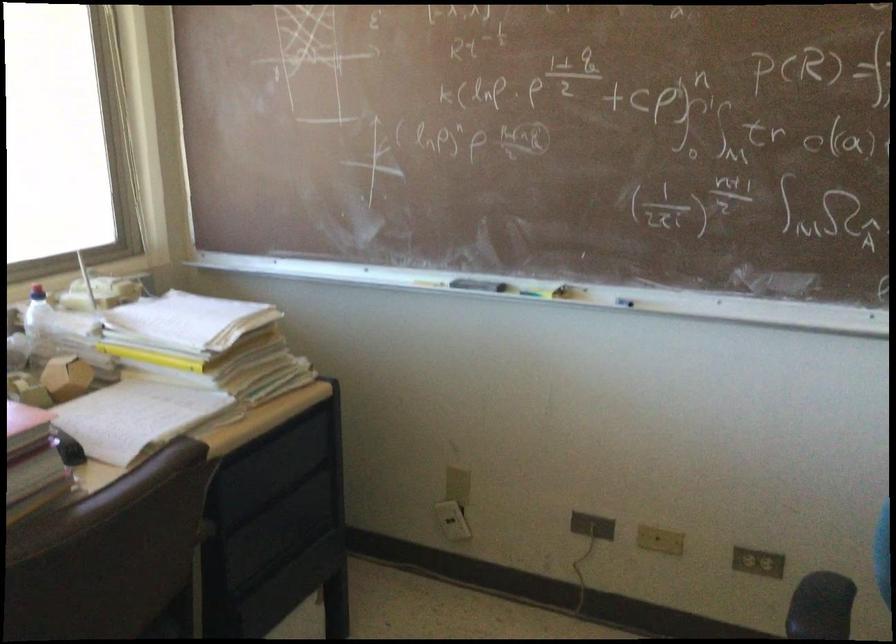
What are the coordinates of `cardboard geometric shape` in the screenshot? It's located at (65, 377).